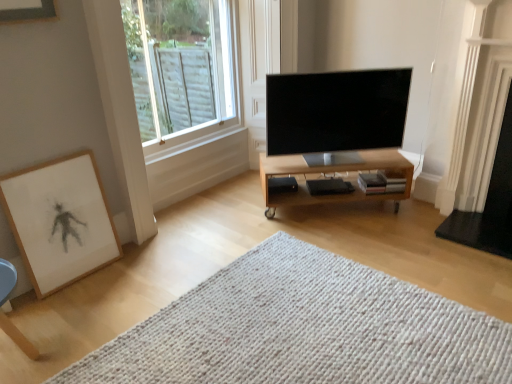
Identify the location of free space on the front side of light wood/finished table at center. (375, 243).